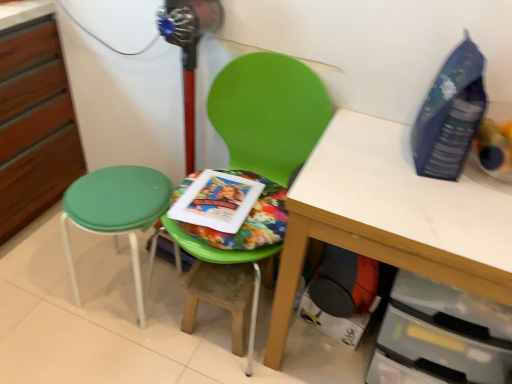
This screenshot has height=384, width=512. I want to click on vacant space in between green fabric stool at left and green plastic chair at center, so click(156, 284).